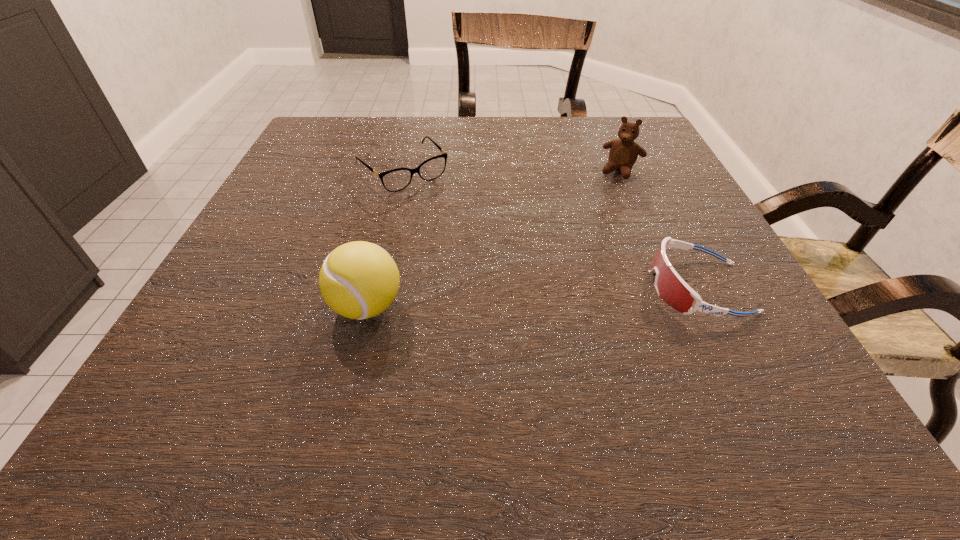
This screenshot has height=540, width=960. Find the location of `tennis ball`. tennis ball is located at coordinates (358, 280).

What are the coordinates of `goggles` in the screenshot? It's located at (671, 288).

I want to click on the shortest object, so click(394, 180).

Image resolution: width=960 pixels, height=540 pixels. Find the location of `teddy bear`. teddy bear is located at coordinates (623, 154).

Find the location of a particular element. free location located 0.130m on the left of the tennis ball is located at coordinates (249, 307).

The height and width of the screenshot is (540, 960). In order to click on vacant region located 0.130m on the front-facing side of the third tallest object in this screenshot , I will do `click(570, 287)`.

In order to click on vacant space located 0.150m on the front-facing side of the third tallest object in this screenshot , I will do `click(559, 287)`.

Where is `free region located on the front-facing side of the third tallest object`? This screenshot has width=960, height=540. free region located on the front-facing side of the third tallest object is located at coordinates (607, 287).

The height and width of the screenshot is (540, 960). I want to click on vacant space located 0.320m on the front-facing side of the spectacles, so click(x=513, y=280).

Locate an element on the screen. vacant region located 0.300m on the front-facing side of the spectacles is located at coordinates (506, 273).